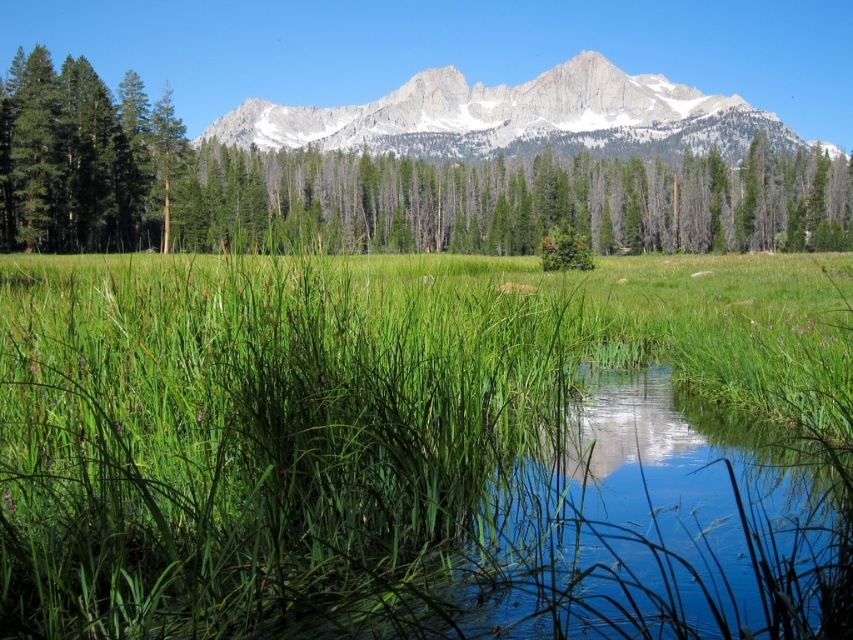
Question: Which object is positioned farthest from the green matte tree at center?

Choices:
 (A) white rocky mountain range at upper center
 (B) green grassy at center
 (C) green leafy tree at upper center

Answer: (A)

Question: Is green matte tree at center smaller than white rocky mountain range at upper center?

Choices:
 (A) yes
 (B) no

Answer: (A)

Question: Among these objects, which one is farthest from the camera?

Choices:
 (A) green grassy at center
 (B) white rocky mountain range at upper center

Answer: (B)

Question: Does green grassy at center lie behind green matte tree at left?

Choices:
 (A) no
 (B) yes

Answer: (A)

Question: Is white rocky mountain range at upper center wider than green matte tree at left?

Choices:
 (A) no
 (B) yes

Answer: (B)

Question: Which point is closer to the camera?

Choices:
 (A) (61, 236)
 (B) (109, 147)

Answer: (B)